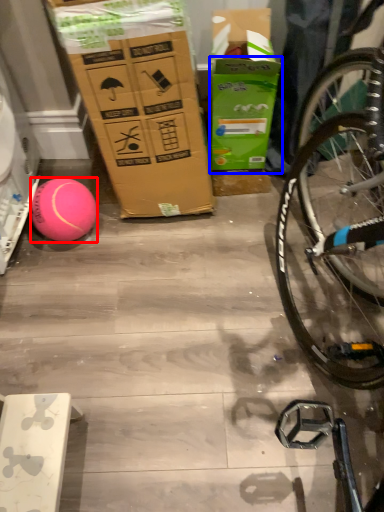
Question: Which of the following is the closest to the observer, ball (highlighted by a red box) or cardboard box (highlighted by a blue box)?

Choices:
 (A) ball
 (B) cardboard box

Answer: (B)